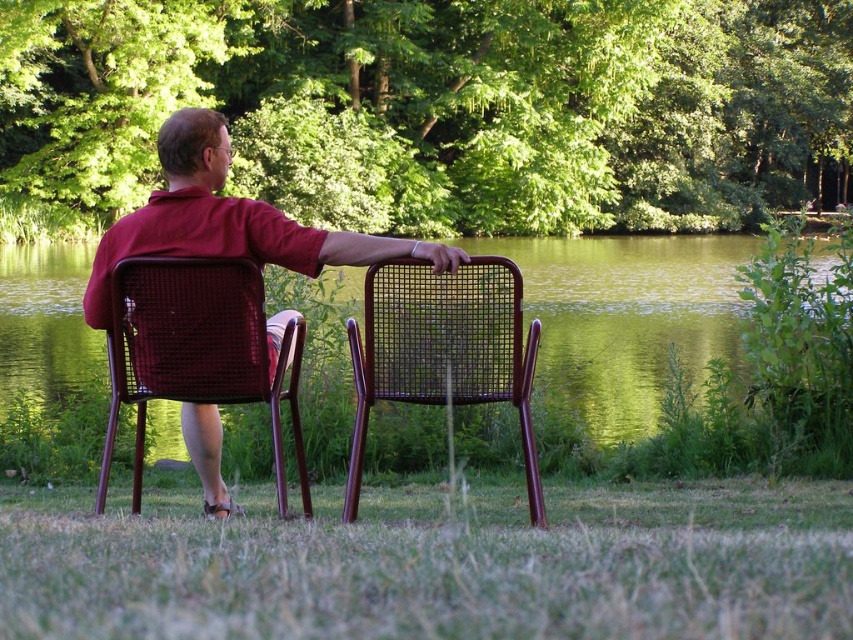
Does brown wicker chair at left come behind brown wicker chair at center?

No, brown wicker chair at left is in front of brown wicker chair at center.

Which is in front, point (173, 342) or point (474, 339)?

Positioned in front is point (173, 342).

Between point (204, 323) and point (379, 282), which one is positioned behind?

The point (379, 282) is more distant.

At what (x,y) coordinates should I click in order to perform the action: click on brown wicker chair at left. Please return your answer as a coordinate pair (x, y). The image size is (853, 640). Looking at the image, I should click on click(x=196, y=353).

Which is more to the left, matte wicker chair at center or brown wicker chair at center?

matte wicker chair at center

You are a GUI agent. You are given a task and a screenshot of the screen. Output one action in this format:
    pyautogui.click(x=<x>, y=<y>)
    Task: Click on the matte wicker chair at center
    This screenshot has height=640, width=853.
    Given the screenshot: What is the action you would take?
    pyautogui.click(x=228, y=220)

Find the location of a particular element. matte wicker chair at center is located at coordinates (228, 220).

Does green wavy water at center have a greater width compared to brown wicker chair at center?

Yes.

What do you see at coordinates (627, 317) in the screenshot? The width and height of the screenshot is (853, 640). I see `green wavy water at center` at bounding box center [627, 317].

Which is behind, point (582, 388) or point (402, 396)?

Point (582, 388)

Identify the location of green wavy water at center. This screenshot has width=853, height=640. (627, 317).